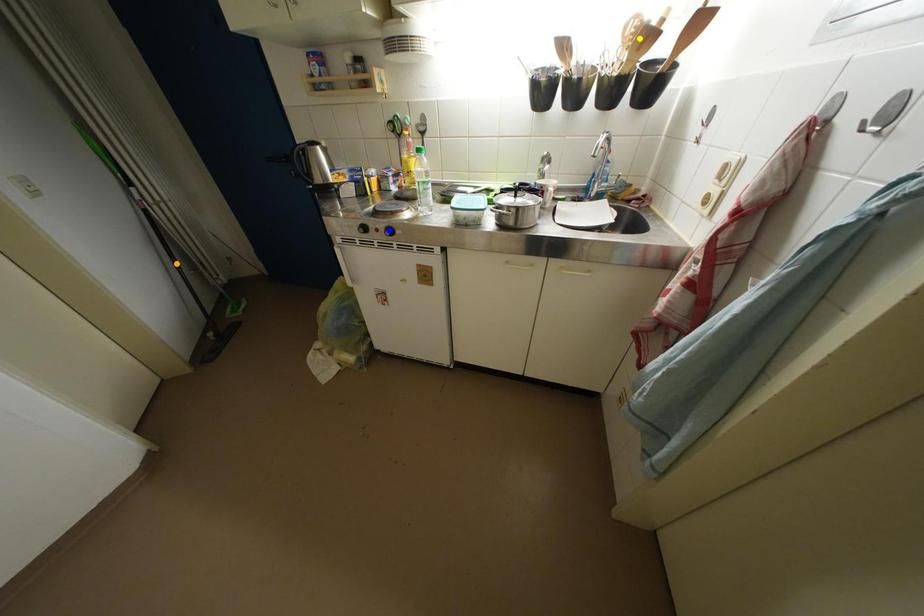
Order these from nearest to farthest:
- yellow point
- blue point
- orange point

yellow point, blue point, orange point